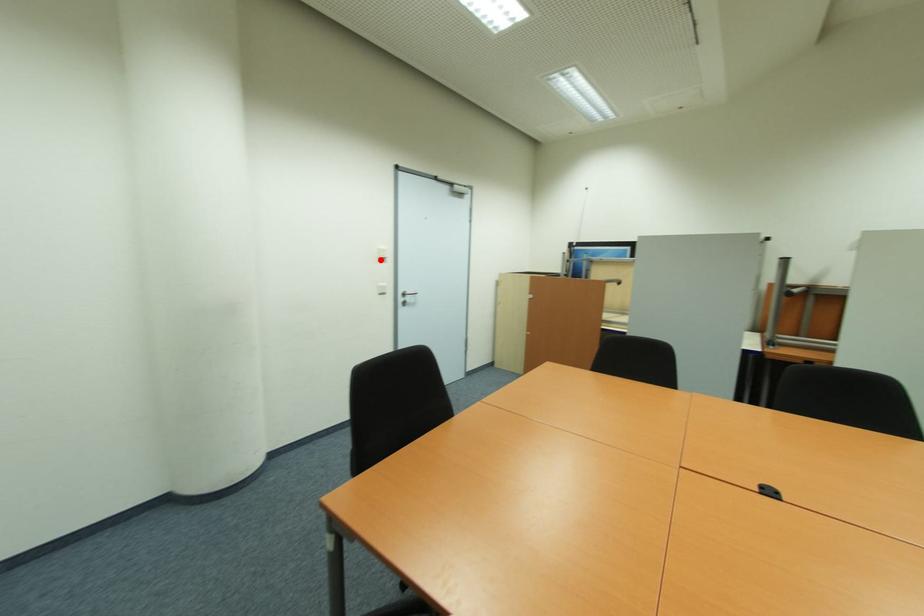
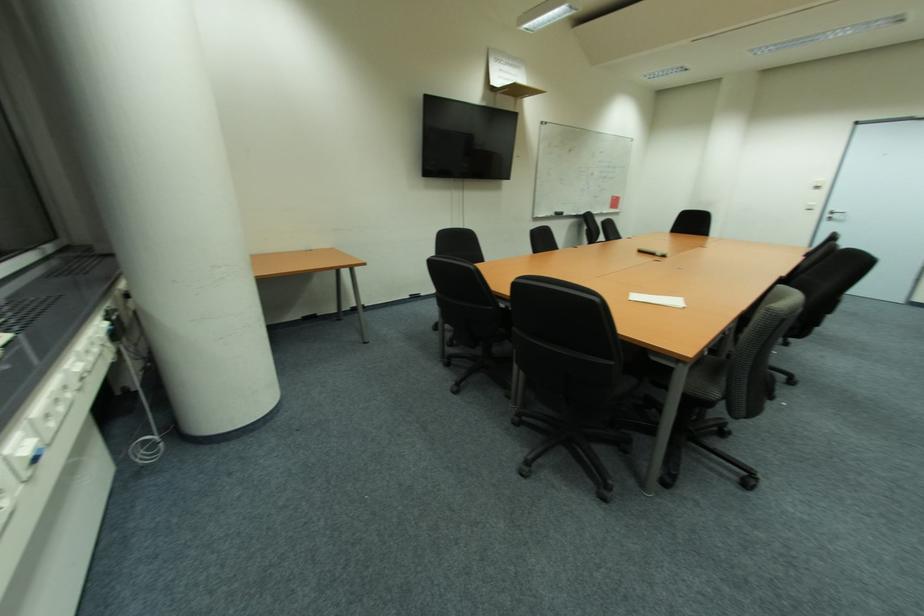
Where in the second image is the point corresponding to the highlighted location from the first image?

(820, 188)